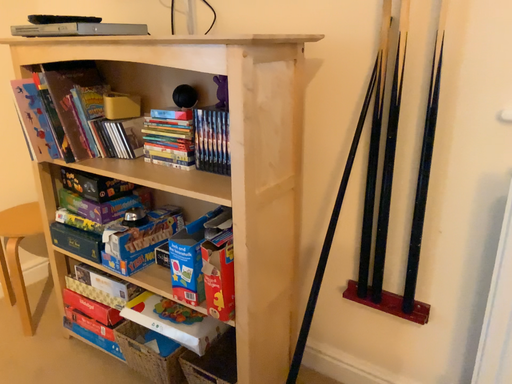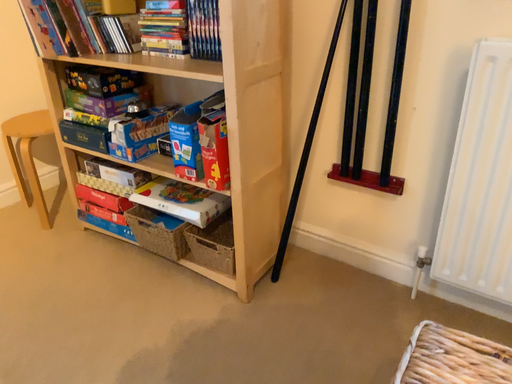
Question: Which way did the camera rotate in the video?

Choices:
 (A) rotated downward
 (B) rotated upward

Answer: (A)